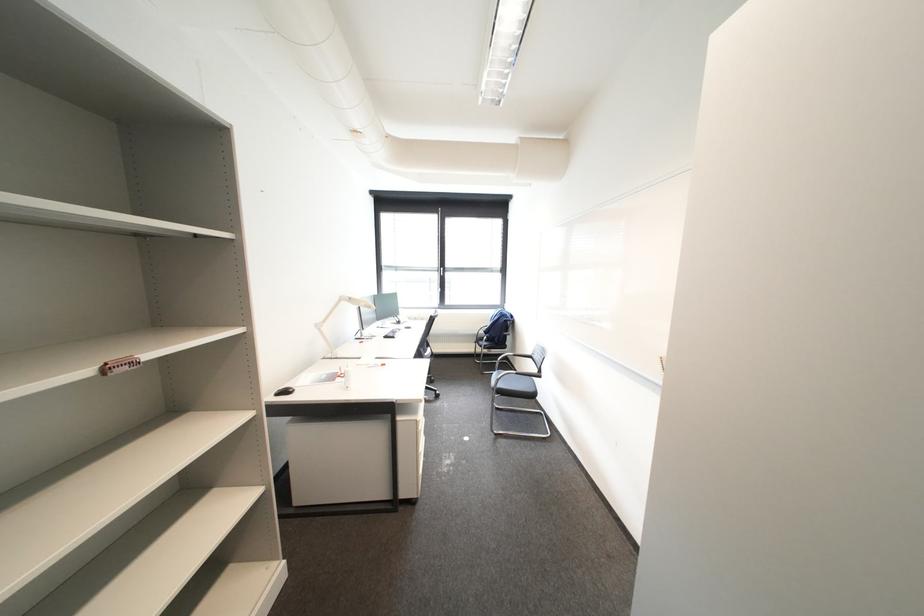
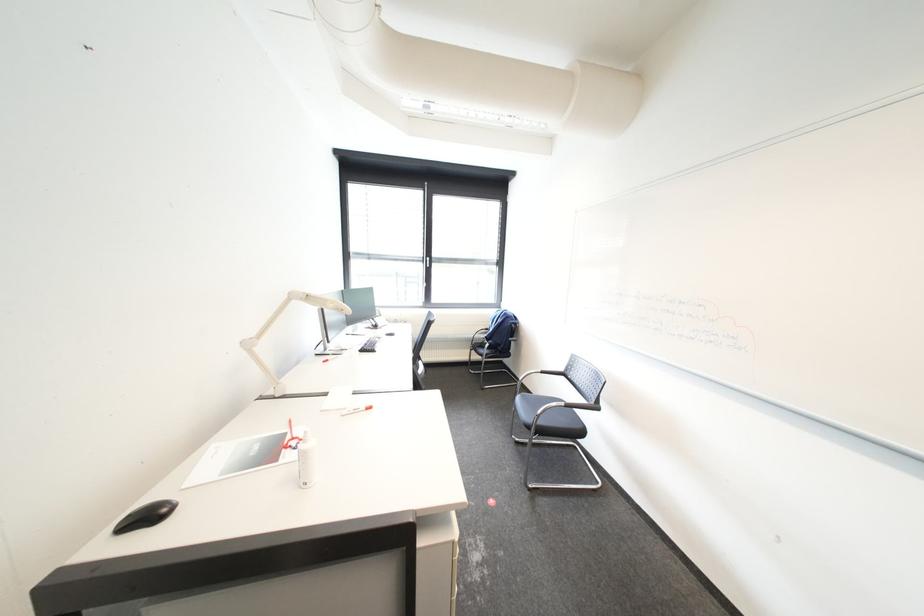
Question: Based on the continuous images, in which direction is the camera rotating? Reply with the corresponding letter.

Choices:
 (A) Left
 (B) Right
 (C) Up
 (D) Down

Answer: (B)